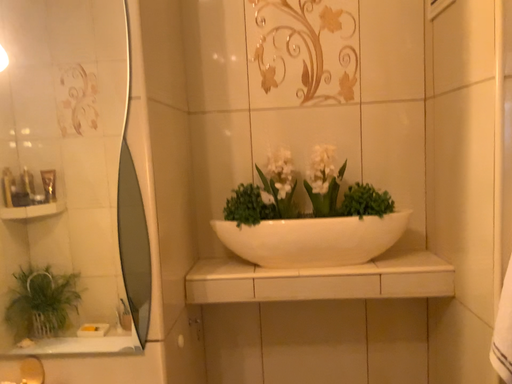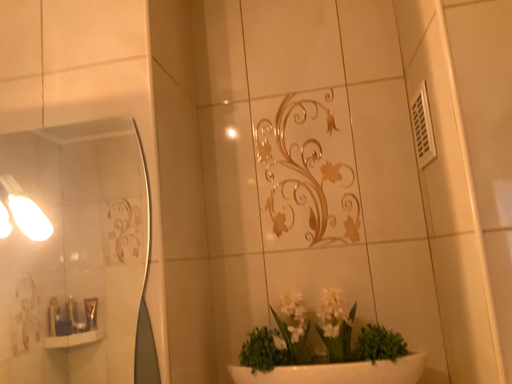
Question: How did the camera likely rotate when shooting the video?

Choices:
 (A) rotated upward
 (B) rotated downward

Answer: (A)